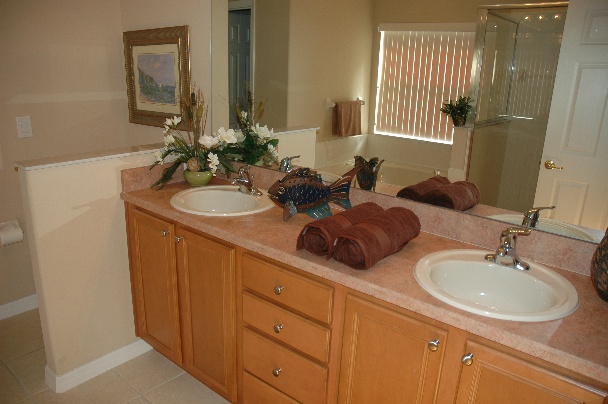
The width and height of the screenshot is (608, 404). In order to click on towel in this screenshot , I will do `click(375, 223)`, `click(326, 241)`, `click(449, 191)`, `click(432, 191)`, `click(354, 120)`.